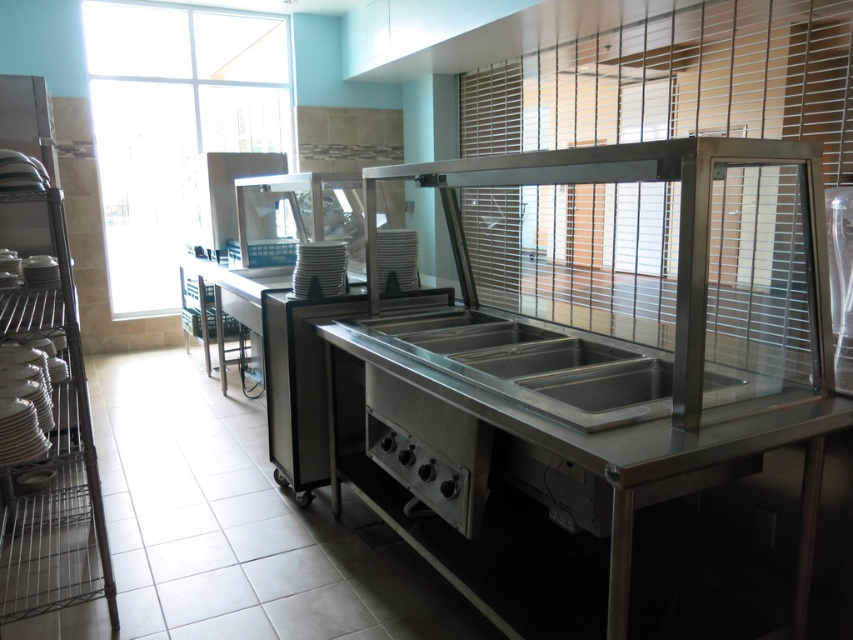
Does point (514, 508) come in front of point (631, 419)?

No.

How much distance is there between stainless steel buffet at center and stainless steel sink at center?

stainless steel buffet at center and stainless steel sink at center are 11.93 centimeters apart.

What do you see at coordinates (601, 400) in the screenshot?
I see `stainless steel buffet at center` at bounding box center [601, 400].

What are the coordinates of `stainless steel buffet at center` in the screenshot? It's located at (601, 400).